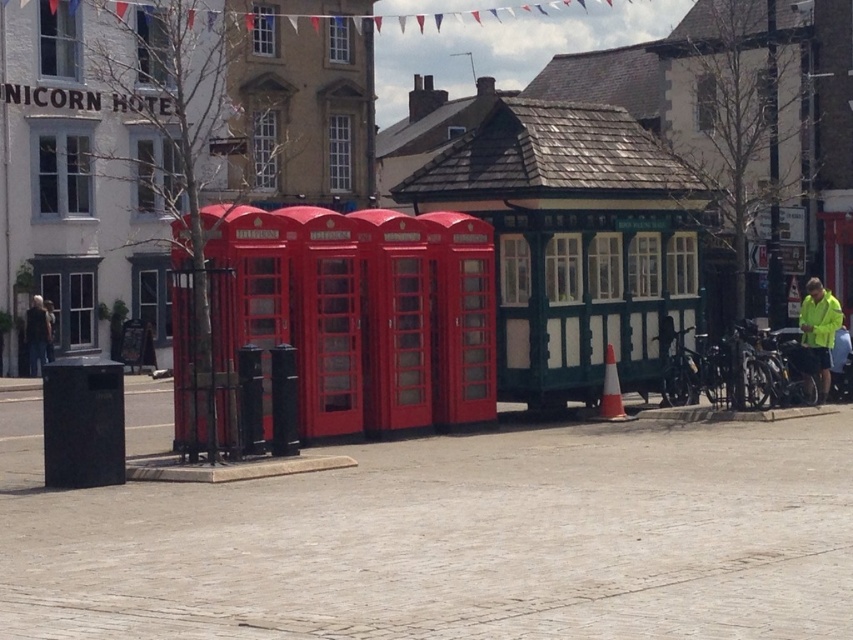
You are a tourist in this urban area and you see two jackets hanging on a rack near the red telephone boxes. The neon yellow jacket at right and the dark gray jacket at left. Which jacket is bigger in size?

The neon yellow jacket at right is larger in size than the dark gray jacket at left.

You are a tourist in this urban area and notice two jackets hanging on a rack near the red telephone boxes. The neon yellow jacket at right and the dark gray jacket at left. Which jacket is positioned higher on the rack?

The neon yellow jacket at right is located above the dark gray jacket at left, so it is positioned higher on the rack.

Based on the photo, you are a tourist standing in front of the red telephone boxes and you see two jackets hanging on a rack nearby. The neon yellow jacket at right and the dark gray jacket at left. Which jacket is positioned more to the east?

The neon yellow jacket at right is positioned more to the east because it is to the right of the dark gray jacket at left, and assuming the tourist is facing north towards the telephone boxes, right would correspond to the east direction.